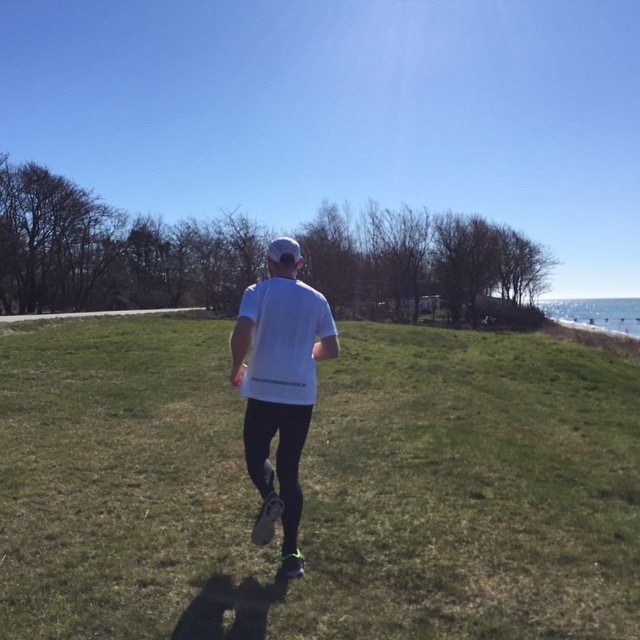
Question: Where is green grass at center located in relation to white matte t-shirt at center in the image?

Choices:
 (A) right
 (B) left

Answer: (B)

Question: Is green grass at center positioned before white matte t-shirt at center?

Choices:
 (A) yes
 (B) no

Answer: (A)

Question: Is green grass at center wider than white matte t-shirt at center?

Choices:
 (A) no
 (B) yes

Answer: (B)

Question: Which of the following is the farthest from the observer?

Choices:
 (A) green grass at center
 (B) white matte t-shirt at center

Answer: (B)